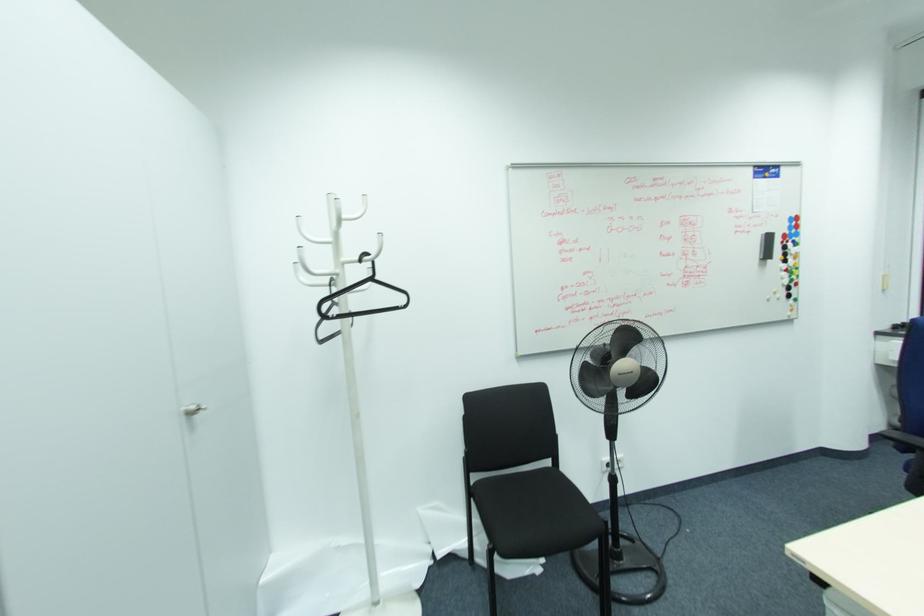
Which object does [767,246] point to?

This point indicates the black whiteboard eraser.